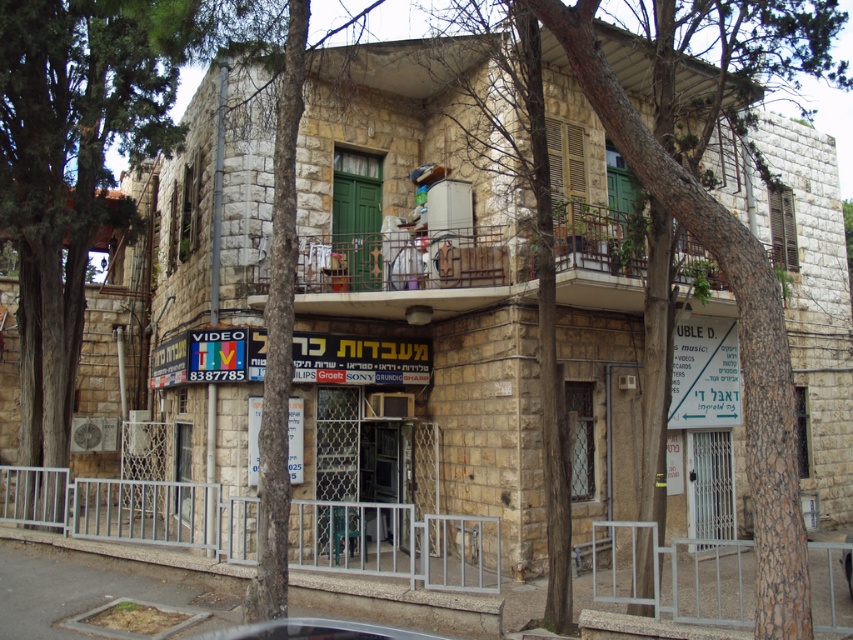
Is green leafy tree at left to the left of metallic silver car at center from the viewer's perspective?

Yes, green leafy tree at left is to the left of metallic silver car at center.

Is point (70, 301) in front of point (846, 564)?

No, (70, 301) is further to viewer.

The width and height of the screenshot is (853, 640). I want to click on green leafy tree at left, so click(x=67, y=177).